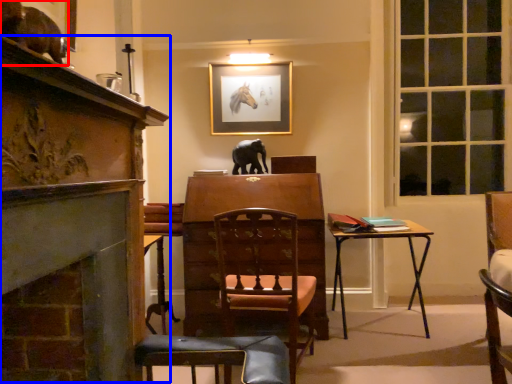
Question: Which object appears farthest to the camera in this image, animal (highlighted by a red box) or fireplace (highlighted by a blue box)?

Choices:
 (A) animal
 (B) fireplace

Answer: (A)